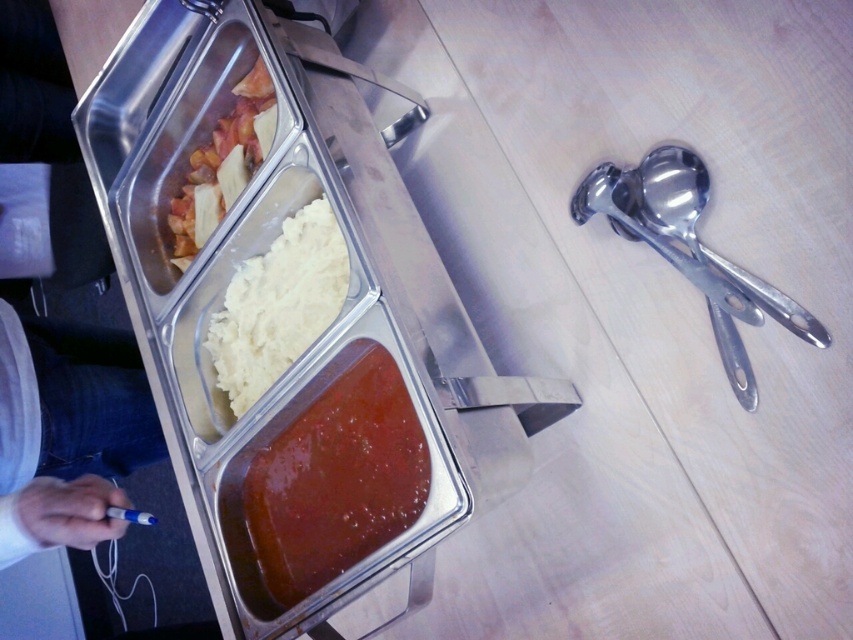
You are standing at the buffet station and want to reach the point at coordinates point (321, 220). If your arm can extend 36 inches, will you be able to reach it?

The point (321, 220) is 39.20 inches away from you, which is beyond your arm reach of 36 inches. You will not be able to reach it.

You are at the buffet and want to grab the matte plastic pasta at upper left. Where should you look relative to the stainless steel serving tray?

The matte plastic pasta at upper left is located at the upper left position relative to the stainless steel serving tray based on its coordinates at point [223,164].

You are at a buffet and want to serve yourself some mashed potatoes. The white creamy mashed potato at center is your target. However, there is a shiny metallic spoon at right in the way. Based on their positions, can you reach the mashed potatoes without moving the spoon?

The white creamy mashed potato at center is located below the shiny metallic spoon at right, so you can reach it without moving the spoon by accessing it from underneath.